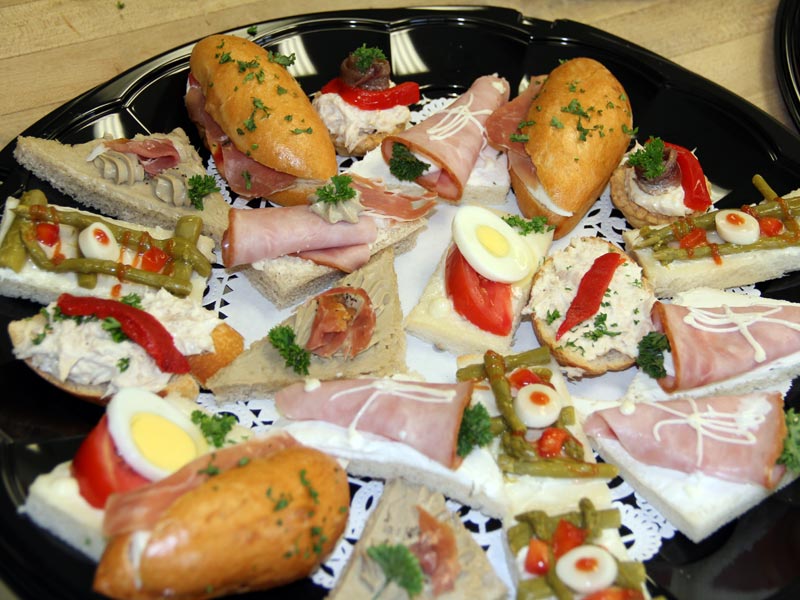
Where is `tray`? The image size is (800, 600). tray is located at coordinates (33, 422).